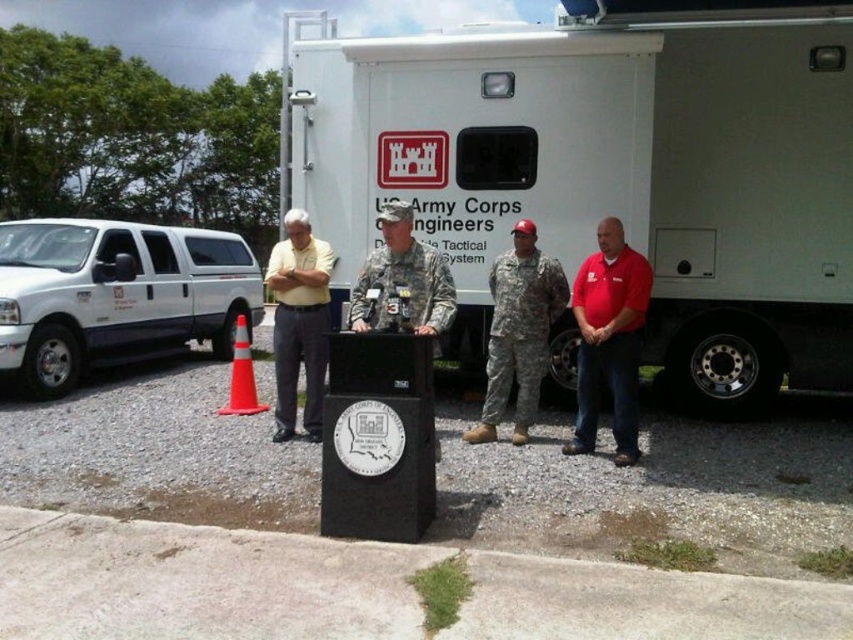
Can you confirm if white matte van at left is shorter than red cotton shirt at right?

No, white matte van at left is not shorter than red cotton shirt at right.

Where is `white matte van at left`? white matte van at left is located at coordinates (115, 294).

What do you see at coordinates (115, 294) in the screenshot?
I see `white matte van at left` at bounding box center [115, 294].

Find the location of a particular element. white matte van at left is located at coordinates (115, 294).

Is white matte truck at center bigger than red cotton shirt at right?

Indeed, white matte truck at center has a larger size compared to red cotton shirt at right.

Can you confirm if white matte truck at center is positioned below red cotton shirt at right?

Actually, white matte truck at center is above red cotton shirt at right.

Find the location of a particular element. white matte truck at center is located at coordinates (614, 172).

Can you confirm if red cotton shirt at right is shorter than camouflage fabric soldier at center?

Incorrect, red cotton shirt at right's height does not fall short of camouflage fabric soldier at center's.

Is point (605, 262) farther from viewer compared to point (520, 365)?

That is False.

What do you see at coordinates (608, 339) in the screenshot? I see `red cotton shirt at right` at bounding box center [608, 339].

Locate an element on the screen. Image resolution: width=853 pixels, height=640 pixels. red cotton shirt at right is located at coordinates (608, 339).